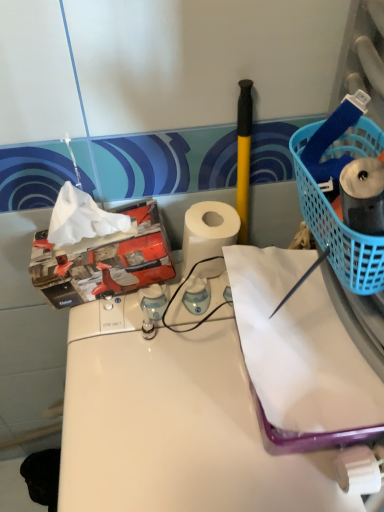
The height and width of the screenshot is (512, 384). Identify the location of white matte paper towel at center. (208, 231).

Describe the element at coordinates (208, 231) in the screenshot. This screenshot has height=512, width=384. I see `white matte paper towel at center` at that location.

Locate an element on the screen. The image size is (384, 512). white glossy counter at center is located at coordinates (174, 425).

Could you tell me if white matte paper towel at center is turned towards blue plastic basket at right?

No, white matte paper towel at center is not oriented towards blue plastic basket at right.

Is white matte paper towel at center in front of blue plastic basket at right?

No, white matte paper towel at center is further to the viewer.

Does white matte paper towel at center have a greater width compared to blue plastic basket at right?

Yes.

Considering the relative sizes of white glossy counter at center and white matte paper at center in the image provided, is white glossy counter at center taller than white matte paper at center?

Yes.

Image resolution: width=384 pixels, height=512 pixels. In the image, there is a white matte paper at center. What are the coordinates of `counter below it (from the image's perspective)` in the screenshot? It's located at (174, 425).

Is white matte paper at center facing away from blue plastic basket at right?

white matte paper at center does not have its back to blue plastic basket at right.

Which is more to the right, white matte paper at center or blue plastic basket at right?

white matte paper at center.

From a real-world perspective, is white matte paper at center located beneath blue plastic basket at right?

Correct, in the physical world, white matte paper at center is lower than blue plastic basket at right.

Identify the location of paper that is on the right side of blue plastic basket at right. (299, 345).

Who is more distant, white matte paper at center or white matte paper towel at center?

white matte paper towel at center is behind.

From the image's perspective, is white matte paper at center positioned above or below white matte paper towel at center?

Clearly, from the image's perspective, white matte paper at center is below white matte paper towel at center.

Is white matte paper towel at center located within white matte paper at center?

→ Definitely not — white matte paper towel at center is not inside white matte paper at center.

From a real-world perspective, is white matte paper at center positioned under white matte paper towel at center based on gravity?

Yes, from a real-world perspective, white matte paper at center is beneath white matte paper towel at center.

Is white matte paper towel at center wider than white glossy counter at center?

Incorrect, the width of white matte paper towel at center does not surpass that of white glossy counter at center.

Which of these two, white matte paper towel at center or white glossy counter at center, stands shorter?

With less height is white matte paper towel at center.

Image resolution: width=384 pixels, height=512 pixels. What are the coordinates of `paper towel behind the white glossy counter at center` in the screenshot? It's located at (208, 231).

Are white matte paper towel at center and white glossy counter at center far apart?

No, white matte paper towel at center is not far away from white glossy counter at center.

Between point (346, 253) and point (216, 250), which one is positioned in front?

The point (346, 253) is more forward.

Does blue plastic basket at right have a smaller size compared to white matte paper towel at center?

Correct, blue plastic basket at right occupies less space than white matte paper towel at center.

Who is more distant, blue plastic basket at right or white matte paper towel at center?

white matte paper towel at center is more distant.

How different are the orientations of blue plastic basket at right and white matte paper towel at center in degrees?

90.5 degrees separate the facing orientations of blue plastic basket at right and white matte paper towel at center.

From the image's perspective, is white glossy counter at center on white matte paper towel at center?

Actually, white glossy counter at center appears below white matte paper towel at center in the image.

Looking at this image, how far apart are white glossy counter at center and white matte paper towel at center?

A distance of 8.70 inches exists between white glossy counter at center and white matte paper towel at center.

Would you say white matte paper towel at center is part of white glossy counter at center's contents?

No, white matte paper towel at center is not a part of white glossy counter at center.

This screenshot has width=384, height=512. What are the coordinates of `counter on the left of white matte paper towel at center` in the screenshot? It's located at (174, 425).

Find the location of `paper towel behind the blue plastic basket at right`. paper towel behind the blue plastic basket at right is located at coordinates (208, 231).

This screenshot has width=384, height=512. Find the location of `paper to the right of white glossy counter at center`. paper to the right of white glossy counter at center is located at coordinates (299, 345).

Looking at this image, estimate the real-world distances between objects in this image. Which object is further from white matte paper towel at center, blue plastic basket at right or white matte paper at center?

The object further to white matte paper towel at center is blue plastic basket at right.

Consider the image. From the image, which object appears to be farther from blue plastic basket at right, white glossy counter at center or white matte paper at center?

Based on the image, white glossy counter at center appears to be further to blue plastic basket at right.

From the image, which object appears to be farther from white matte paper towel at center, white matte paper at center or white glossy counter at center?

white glossy counter at center lies further to white matte paper towel at center than the other object.

Based on their spatial positions, is blue plastic basket at right or white matte paper towel at center further from white matte paper at center?

white matte paper towel at center lies further to white matte paper at center than the other object.

Based on their spatial positions, is white glossy counter at center or white matte paper towel at center further from white matte paper at center?

white matte paper towel at center is further to white matte paper at center.

Based on their spatial positions, is white glossy counter at center or white matte paper towel at center further from blue plastic basket at right?

white glossy counter at center lies further to blue plastic basket at right than the other object.

Estimate the real-world distances between objects in this image. Which object is further from white matte paper towel at center, white glossy counter at center or white matte paper at center?

white glossy counter at center is further to white matte paper towel at center.

Considering their positions, is white matte paper at center positioned closer to blue plastic basket at right than white glossy counter at center?

Among the two, white matte paper at center is located nearer to blue plastic basket at right.

What are the coordinates of `paper between blue plastic basket at right and white matte paper towel at center from front to back` in the screenshot? It's located at (299, 345).

This screenshot has width=384, height=512. What are the coordinates of `paper between blue plastic basket at right and white glossy counter at center in the vertical direction` in the screenshot? It's located at (299, 345).

Find the location of a particular element. This screenshot has width=384, height=512. paper between white matte paper towel at center and white glossy counter at center from top to bottom is located at coordinates (299, 345).

Find the location of a particular element. The width and height of the screenshot is (384, 512). paper towel between blue plastic basket at right and white glossy counter at center vertically is located at coordinates (208, 231).